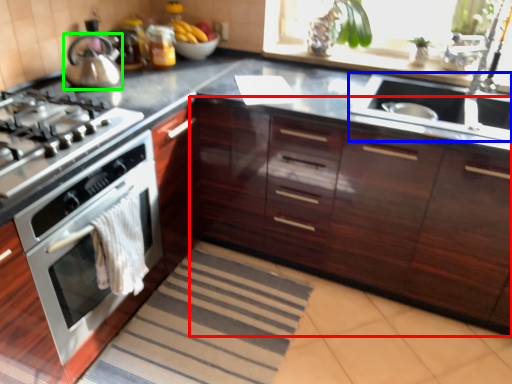
Question: Considering the real-world distances, which object is closest to cabinetry (highlighted by a red box)? sink (highlighted by a blue box) or kitchen appliance (highlighted by a green box).

Choices:
 (A) sink
 (B) kitchen appliance

Answer: (A)